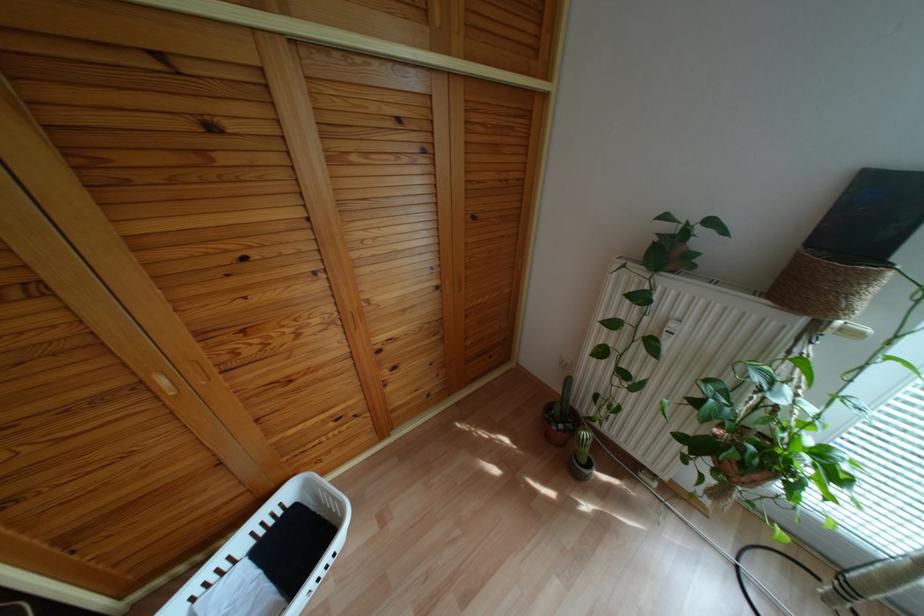
The height and width of the screenshot is (616, 924). I want to click on white wall outlet, so click(565, 363).